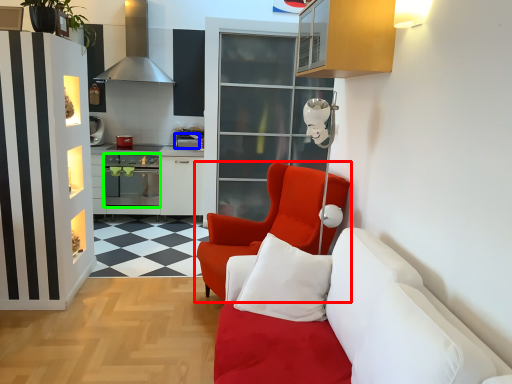
Question: Which object is the farthest from chair (highlighted by a red box)? Choose among these: appliance (highlighted by a blue box) or oven (highlighted by a green box).

Choices:
 (A) appliance
 (B) oven

Answer: (B)